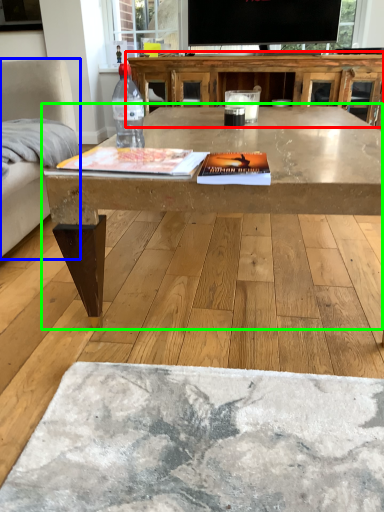
Question: Which object is the farthest from table (highlighted by a red box)? Choose among these: armchair (highlighted by a blue box) or coffee table (highlighted by a green box).

Choices:
 (A) armchair
 (B) coffee table

Answer: (A)